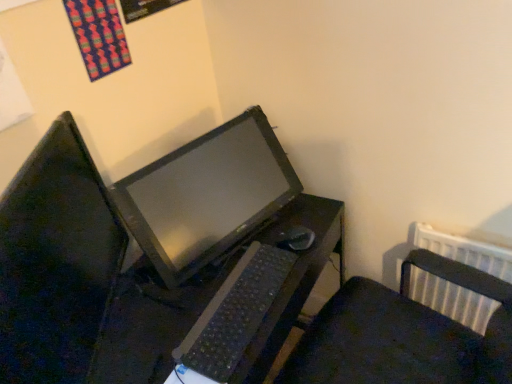
Question: Are black plastic desk at center and black plastic keyboard at center beside each other?

Choices:
 (A) no
 (B) yes

Answer: (B)

Question: Does black plastic desk at center come behind black plastic keyboard at center?

Choices:
 (A) no
 (B) yes

Answer: (A)

Question: From a real-world perspective, does black plastic desk at center sit lower than black plastic keyboard at center?

Choices:
 (A) yes
 (B) no

Answer: (A)

Question: Is black plastic desk at center at the right side of black plastic keyboard at center?

Choices:
 (A) yes
 (B) no

Answer: (B)

Question: Could black plastic keyboard at center be considered to be inside black plastic desk at center?

Choices:
 (A) no
 (B) yes

Answer: (A)

Question: From their relative heights in the image, would you say black plastic keyboard at center is taller or shorter than matte black monitor at center?

Choices:
 (A) tall
 (B) short

Answer: (B)

Question: Relative to matte black monitor at center, is black plastic keyboard at center in front or behind?

Choices:
 (A) behind
 (B) front

Answer: (A)

Question: Is point (231, 283) closer or farther from the camera than point (69, 198)?

Choices:
 (A) farther
 (B) closer

Answer: (A)

Question: Visually, is black plastic keyboard at center positioned to the left or to the right of matte black monitor at center?

Choices:
 (A) right
 (B) left

Answer: (A)

Question: Considering their positions, is matte black monitor at center located in front of or behind black plastic desk at center?

Choices:
 (A) front
 (B) behind

Answer: (A)

Question: Considering the relative positions of matte black monitor at center and black plastic desk at center in the image provided, is matte black monitor at center to the left or to the right of black plastic desk at center?

Choices:
 (A) left
 (B) right

Answer: (A)

Question: Is matte black monitor at center wider or thinner than black plastic desk at center?

Choices:
 (A) thin
 (B) wide

Answer: (A)

Question: Considering the positions of matte black monitor at center and black plastic desk at center in the image, is matte black monitor at center bigger or smaller than black plastic desk at center?

Choices:
 (A) big
 (B) small

Answer: (B)

Question: Considering the positions of black plastic mouse at center and matte black monitor at center in the image, is black plastic mouse at center bigger or smaller than matte black monitor at center?

Choices:
 (A) big
 (B) small

Answer: (B)

Question: Considering their positions, is black plastic mouse at center located in front of or behind matte black monitor at center?

Choices:
 (A) front
 (B) behind

Answer: (B)